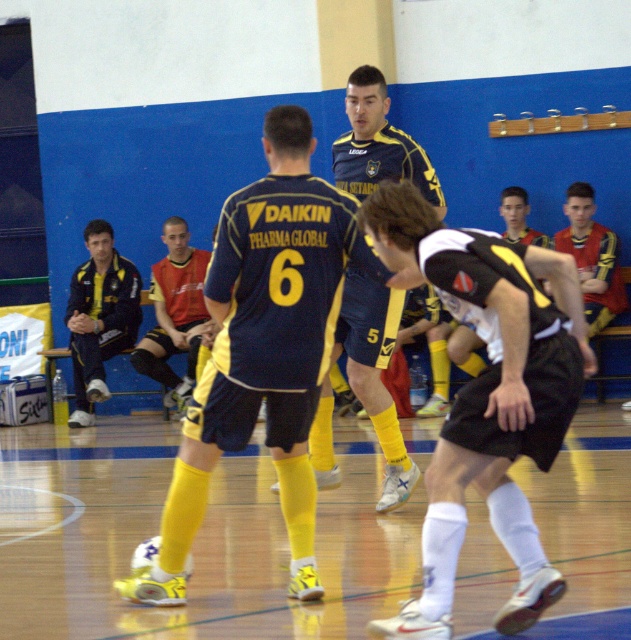
Question: Does white matte jersey at center appear over dark blue track suit at left?

Choices:
 (A) no
 (B) yes

Answer: (A)

Question: Based on their relative distances, which object is nearer to the matte blue jersey at center?

Choices:
 (A) matte blue shorts at center
 (B) dark blue track suit at left
 (C) red jersey at center
 (D) white matte jersey at center

Answer: (D)

Question: Estimate the real-world distances between objects in this image. Which object is farther from the red jersey at center?

Choices:
 (A) dark blue track suit at left
 (B) matte blue jersey at center
 (C) white matte jersey at center
 (D) matte blue shorts at center

Answer: (C)

Question: Is white matte jersey at center to the left of matte blue shorts at center from the viewer's perspective?

Choices:
 (A) no
 (B) yes

Answer: (A)

Question: Does matte blue jersey at center appear on the left side of red jersey at center?

Choices:
 (A) yes
 (B) no

Answer: (B)

Question: Which point is closer to the camera?

Choices:
 (A) (422, 202)
 (B) (203, 440)
 (C) (156, 330)

Answer: (A)